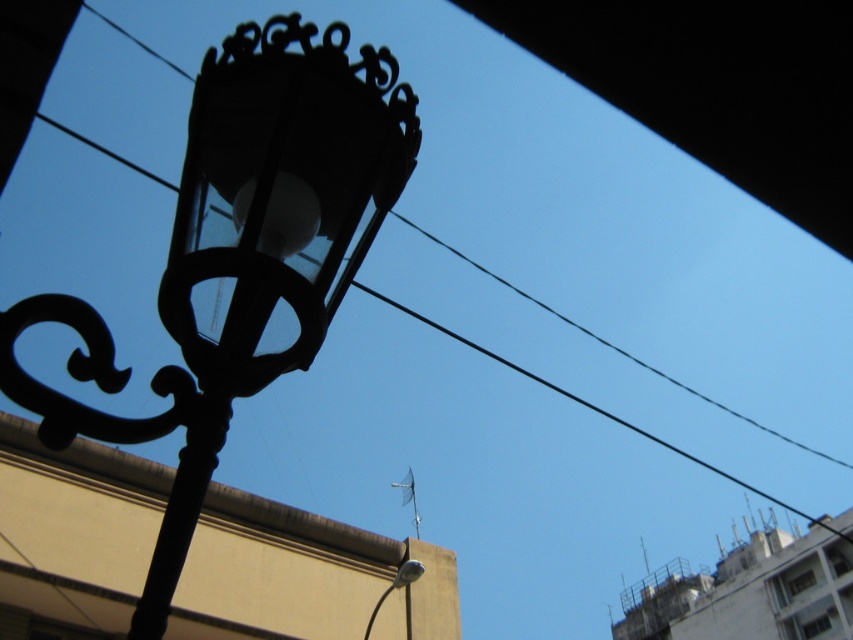
Does point (231, 173) come behind point (415, 579)?

No, (231, 173) is closer to viewer.

Which is in front, point (195, 176) or point (399, 576)?

Positioned in front is point (195, 176).

You are a GUI agent. You are given a task and a screenshot of the screen. Output one action in this format:
    pyautogui.click(x=<x>, y=<y>)
    Task: Click on the black wrought iron lamp post at upper left
    This screenshot has height=640, width=853.
    Given the screenshot: What is the action you would take?
    pyautogui.click(x=241, y=256)